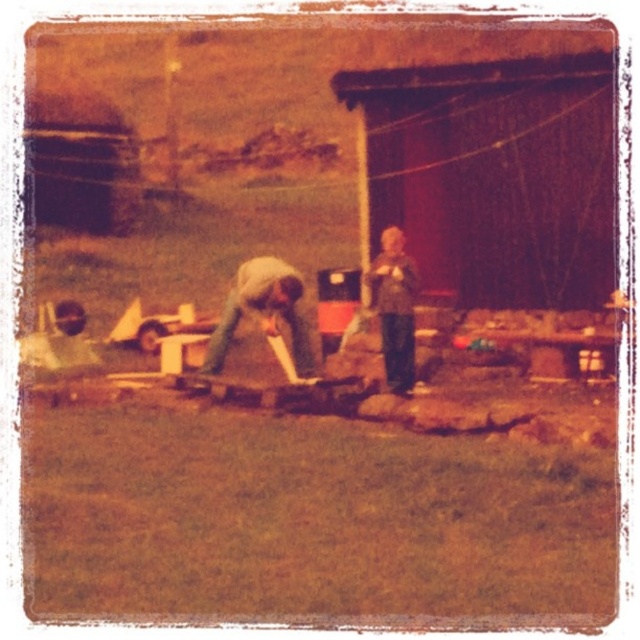
You are standing in the scene and see the denim jacket at center and the textured gray sweater at center. Which one is located to the left?

The denim jacket at center is positioned on the left side of the textured gray sweater at center.

Consider the image. You are standing in the outdoor scene and notice two items on the ground at the center. Which one is shorter between the denim jacket at center and the textured gray sweater at center?

The denim jacket at center is shorter than the textured gray sweater at center.